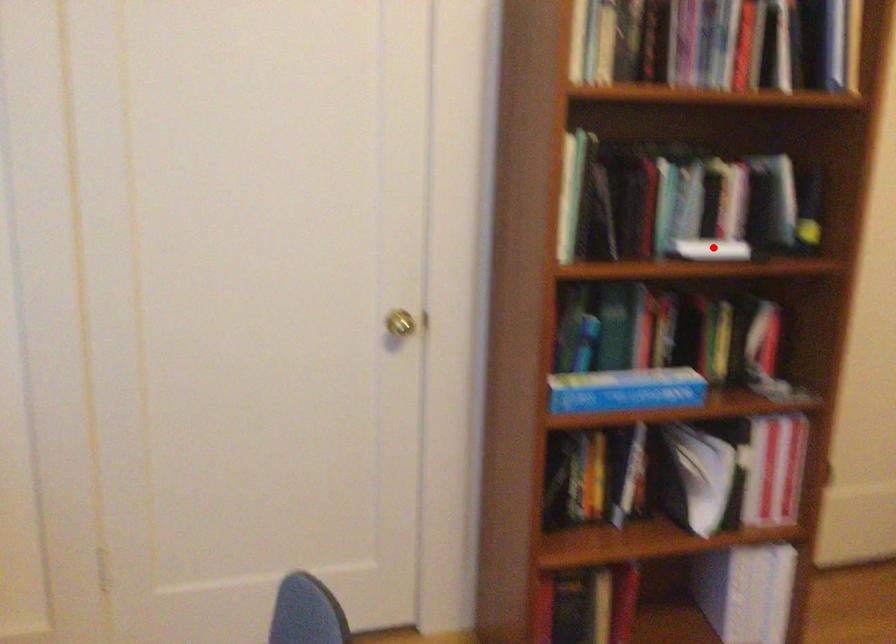
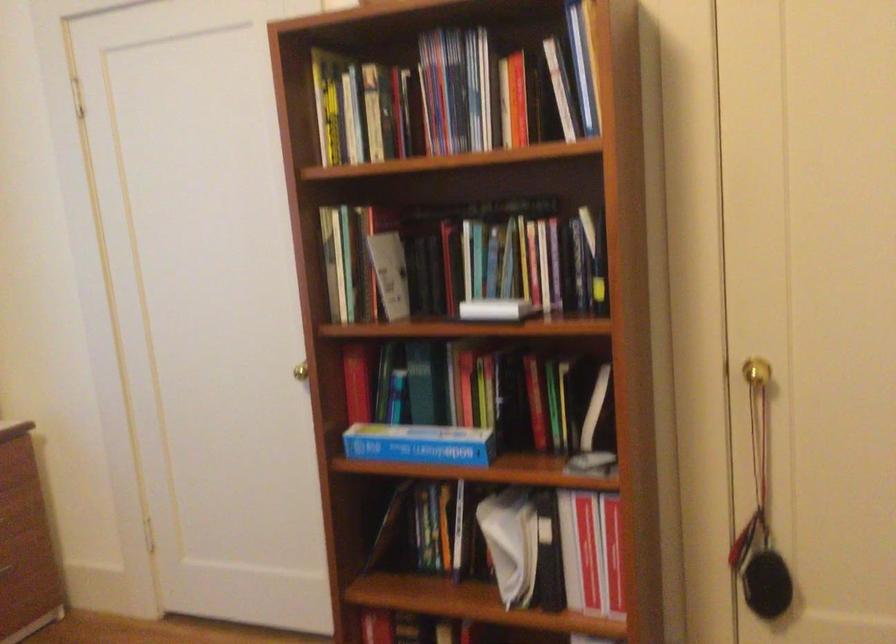
The point at the highlighted location is marked in the first image. Where is the corresponding point in the second image?

(495, 308)